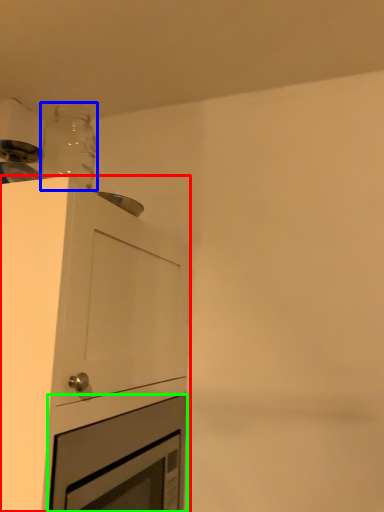
Question: Which object is the farthest from cabinetry (highlighted by a red box)? Choose among these: bottle (highlighted by a blue box) or oven (highlighted by a green box).

Choices:
 (A) bottle
 (B) oven

Answer: (A)